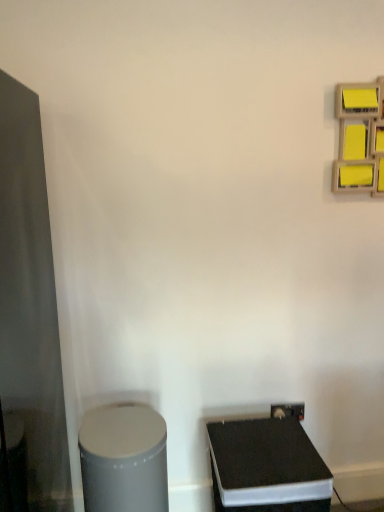
Question: Is yellow matte sticky notes at upper right looking in the opposite direction of black matte speaker at lower right, which appears as the first wide when viewed from the right?

Choices:
 (A) no
 (B) yes

Answer: (A)

Question: Does yellow matte sticky notes at upper right have a greater height compared to black matte speaker at lower right, which is the second wide from left to right?

Choices:
 (A) no
 (B) yes

Answer: (A)

Question: Does yellow matte sticky notes at upper right appear on the left side of black matte speaker at lower right, which is the second wide from left to right?

Choices:
 (A) no
 (B) yes

Answer: (A)

Question: Is yellow matte sticky notes at upper right outside of black matte speaker at lower right, which appears as the first wide when viewed from the right?

Choices:
 (A) yes
 (B) no

Answer: (A)

Question: Can you confirm if yellow matte sticky notes at upper right is smaller than black matte speaker at lower right, which is the second wide from left to right?

Choices:
 (A) no
 (B) yes

Answer: (B)

Question: From the image's perspective, is yellow matte sticky notes at upper right above or below matte black glass door at left?

Choices:
 (A) above
 (B) below

Answer: (A)

Question: Considering the positions of yellow matte sticky notes at upper right and matte black glass door at left in the image, is yellow matte sticky notes at upper right taller or shorter than matte black glass door at left?

Choices:
 (A) tall
 (B) short

Answer: (B)

Question: From a real-world perspective, is yellow matte sticky notes at upper right positioned above or below matte black glass door at left?

Choices:
 (A) below
 (B) above

Answer: (B)

Question: In the image, is yellow matte sticky notes at upper right on the left side or the right side of matte black glass door at left?

Choices:
 (A) left
 (B) right

Answer: (B)

Question: From the image's perspective, relative to matte black glass door at left, is black matte speaker at lower right, which appears as the first wide when viewed from the right, above or below?

Choices:
 (A) below
 (B) above

Answer: (A)

Question: From their relative heights in the image, would you say black matte speaker at lower right, which is the second wide from left to right, is taller or shorter than matte black glass door at left?

Choices:
 (A) short
 (B) tall

Answer: (A)

Question: Is point (306, 457) positioned closer to the camera than point (18, 285)?

Choices:
 (A) closer
 (B) farther

Answer: (A)

Question: Is black matte speaker at lower right, which is the second wide from left to right, bigger or smaller than matte black glass door at left?

Choices:
 (A) small
 (B) big

Answer: (A)

Question: Is matte black glass door at left wider or thinner than black matte speaker at lower right, which is the second wide from left to right?

Choices:
 (A) wide
 (B) thin

Answer: (A)

Question: From the image's perspective, is matte black glass door at left positioned above or below black matte speaker at lower right, which appears as the first wide when viewed from the right?

Choices:
 (A) above
 (B) below

Answer: (A)